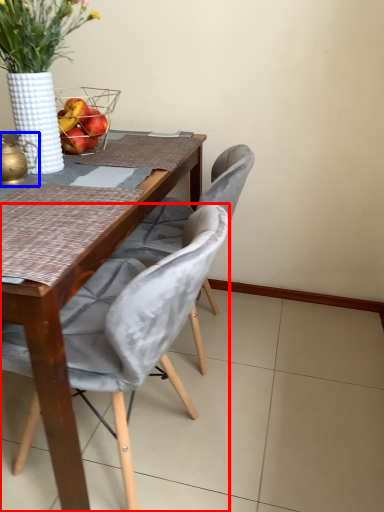
Question: Which of the following is the farthest to the observer, chair (highlighted by a red box) or tea pot (highlighted by a blue box)?

Choices:
 (A) chair
 (B) tea pot

Answer: (B)